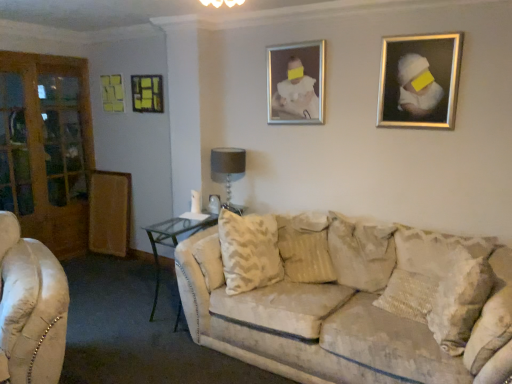
Question: Is beige textured pillow at center, which is the 1th pillow in left-to-right order, positioned beyond the bounds of textured beige pillow at right, which is counted as the third pillow, starting from the left?

Choices:
 (A) yes
 (B) no

Answer: (A)

Question: From the image's perspective, is beige textured pillow at center, which is the 1th pillow in left-to-right order, located beneath textured beige pillow at right, the 1th pillow in the right-to-left sequence?

Choices:
 (A) yes
 (B) no

Answer: (B)

Question: Is beige textured pillow at center, which is the 1th pillow in left-to-right order, turned away from textured beige pillow at right, which is counted as the third pillow, starting from the left?

Choices:
 (A) yes
 (B) no

Answer: (B)

Question: From the image's perspective, is beige textured pillow at center, which is the 1th pillow in left-to-right order, on top of textured beige pillow at right, which is counted as the third pillow, starting from the left?

Choices:
 (A) no
 (B) yes

Answer: (B)

Question: Are beige textured pillow at center, the 3th pillow viewed from the right, and textured beige pillow at right, the 1th pillow in the right-to-left sequence, beside each other?

Choices:
 (A) yes
 (B) no

Answer: (B)

Question: Is point (313, 258) positioned closer to the camera than point (135, 97)?

Choices:
 (A) closer
 (B) farther

Answer: (A)

Question: Which is correct: beige textured pillow at center, which is the 1th pillow in left-to-right order, is inside metallic silver picture frame at upper left, arranged as the 2th picture frame when viewed from the left, or outside of it?

Choices:
 (A) outside
 (B) inside

Answer: (A)

Question: From the image's perspective, is beige textured pillow at center, which is the 1th pillow in left-to-right order, located above or below metallic silver picture frame at upper left, the 3th picture frame in the front-to-back sequence?

Choices:
 (A) below
 (B) above

Answer: (A)

Question: Considering the positions of beige textured pillow at center, the 3th pillow viewed from the right, and metallic silver picture frame at upper left, marked as the 3th picture frame in a right-to-left arrangement, in the image, is beige textured pillow at center, the 3th pillow viewed from the right, wider or thinner than metallic silver picture frame at upper left, marked as the 3th picture frame in a right-to-left arrangement,?

Choices:
 (A) thin
 (B) wide

Answer: (B)

Question: Is clear glass table at center taller or shorter than beige textured pillow at center, which is the 1th pillow in left-to-right order?

Choices:
 (A) tall
 (B) short

Answer: (A)

Question: Does point (154, 256) appear closer or farther from the camera than point (310, 213)?

Choices:
 (A) farther
 (B) closer

Answer: (A)

Question: Is clear glass table at center inside or outside of beige textured pillow at center, the 3th pillow viewed from the right?

Choices:
 (A) outside
 (B) inside

Answer: (A)

Question: Based on their positions, is clear glass table at center located to the left or right of beige textured pillow at center, which is the 1th pillow in left-to-right order?

Choices:
 (A) right
 (B) left

Answer: (B)

Question: Is gray fabric lampshade at center spatially inside clear glass table at center, or outside of it?

Choices:
 (A) inside
 (B) outside

Answer: (B)

Question: Relative to clear glass table at center, is gray fabric lampshade at center in front or behind?

Choices:
 (A) front
 (B) behind

Answer: (B)